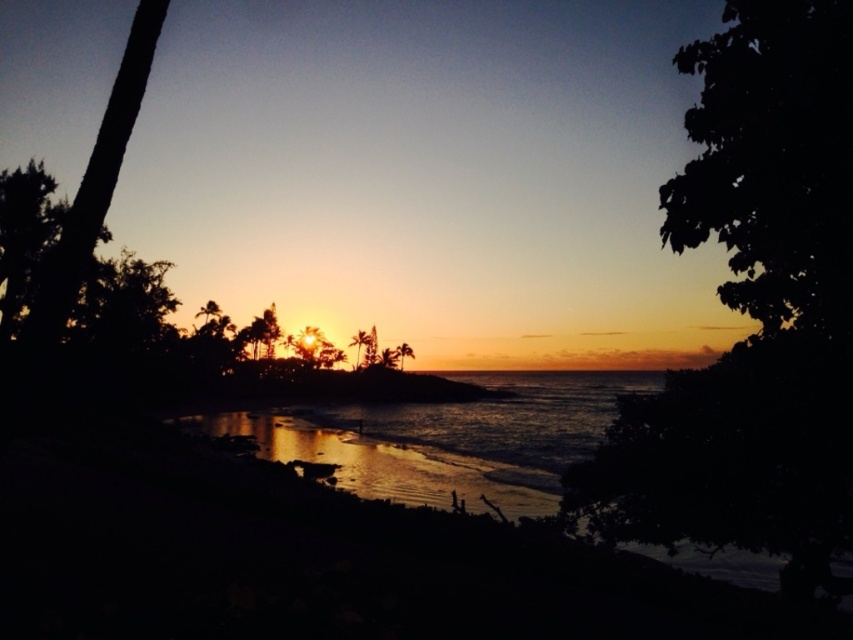
Consider the image. Does dark leafy tree at right have a smaller size compared to green leafy palm tree at center?

No, dark leafy tree at right is not smaller than green leafy palm tree at center.

Between dark leafy tree at right and green leafy palm tree at center, which one is positioned higher?

dark leafy tree at right is higher up.

Which is in front, point (624, 508) or point (367, 336)?

Point (624, 508)

Find the location of `dark leafy tree at right`. dark leafy tree at right is located at coordinates (753, 310).

Which of these two, dark green leafy tree at upper right or dark brown bark tree at left, stands shorter?

dark brown bark tree at left is shorter.

Does dark green leafy tree at upper right appear over dark brown bark tree at left?

Yes, dark green leafy tree at upper right is above dark brown bark tree at left.

Identify the location of dark green leafy tree at upper right. (772, 163).

Is the position of dark leafy tree at right less distant than that of dark green leafy tree at upper right?

Yes.

Which is below, dark leafy tree at right or dark green leafy tree at upper right?

dark leafy tree at right is below.

The image size is (853, 640). Describe the element at coordinates (753, 310) in the screenshot. I see `dark leafy tree at right` at that location.

Locate an element on the screen. dark leafy tree at right is located at coordinates (753, 310).